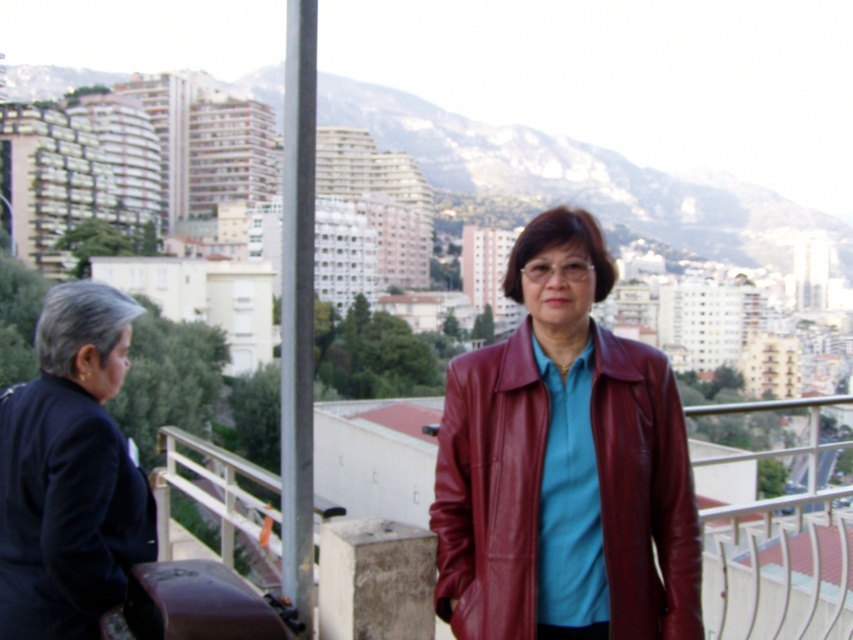
Question: Can you confirm if shiny maroon leather jacket at center is wider than dark blue leather jacket at left?

Choices:
 (A) yes
 (B) no

Answer: (A)

Question: Is shiny maroon leather jacket at center bigger than dark blue leather jacket at left?

Choices:
 (A) yes
 (B) no

Answer: (A)

Question: Does shiny maroon leather jacket at center have a lesser width compared to dark blue leather jacket at left?

Choices:
 (A) yes
 (B) no

Answer: (B)

Question: Which point is closer to the camera?

Choices:
 (A) (496, 584)
 (B) (64, 506)

Answer: (B)

Question: Which point is closer to the camera?

Choices:
 (A) shiny maroon leather jacket at center
 (B) dark blue leather jacket at left

Answer: (B)

Question: Which point is closer to the camera taking this photo?

Choices:
 (A) (461, 627)
 (B) (123, 580)

Answer: (B)